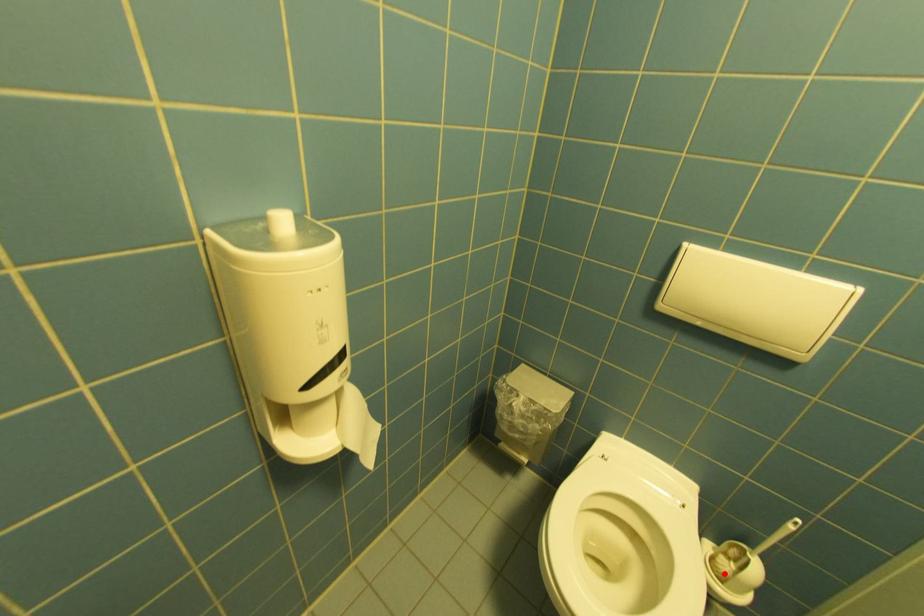
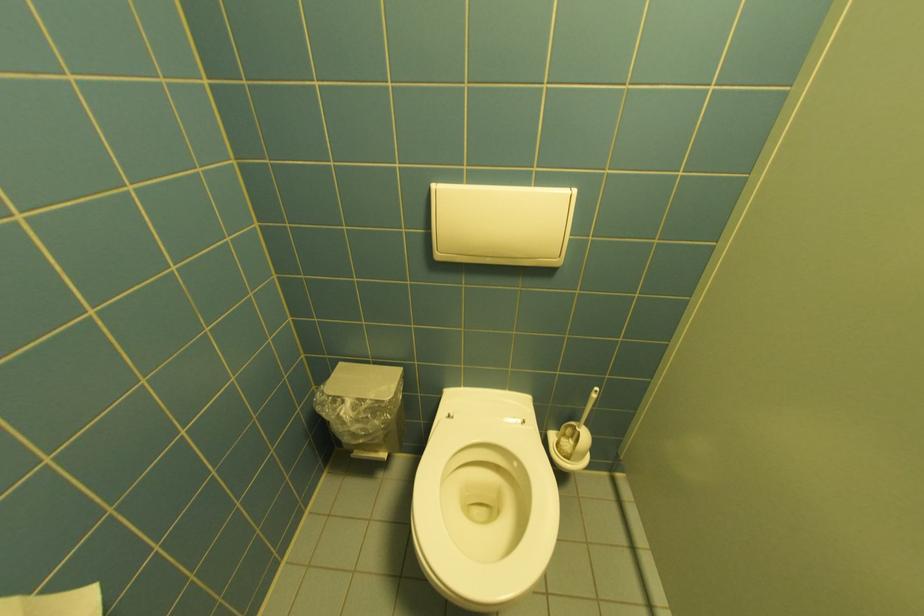
Locate, in the second image, the point that corresponds to the highlighted location in the first image.

(570, 455)